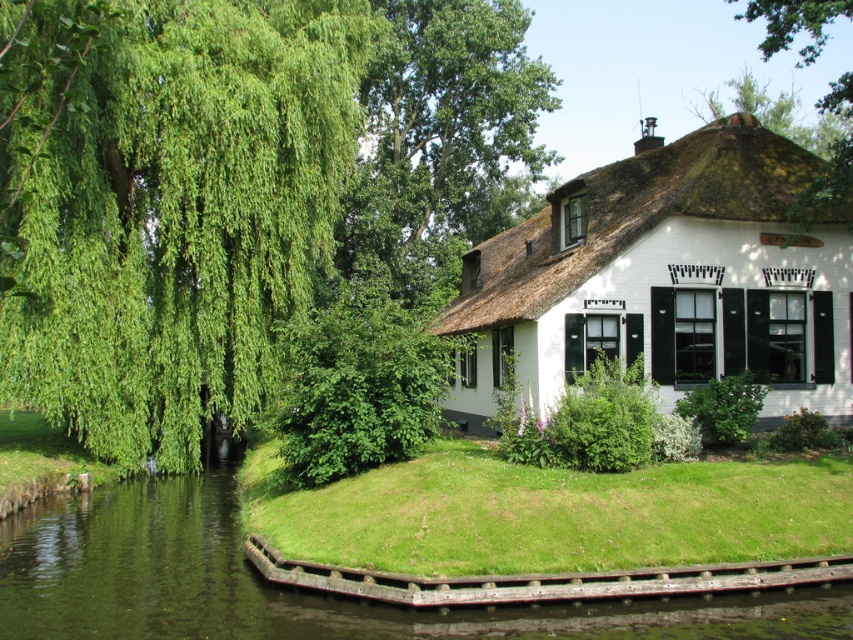
You are standing on the grassy lawn in front of the Dutch house and want to determine which tree is taller between the green leafy willow at left and the green leafy tree at upper center. Based on their positions and the scene description, which tree is taller?

The green leafy willow at left has a lesser height compared to the green leafy tree at upper center, so the green leafy tree at upper center is taller.

You are planning to plant a new tree in your backyard. You have a space that can accommodate a tree as large as the green grassy river at lower left. Can the green leafy willow at left fit in that space?

The green leafy willow at left is larger than the green grassy river at lower left, so it cannot fit in the space designated for the size of the green grassy river at lower left.

You are a gardener planning to plant a new flower bed between the green leafy willow at left and the green grassy river at lower left. The flower bed requires a minimum of 8 meters of space. Based on the scene, is there enough space to accommodate it?

The distance between the green leafy willow at left and the green grassy river at lower left is 7.35 meters, which is less than the required 8 meters. Therefore, there is not enough space to plant the flower bed between them.